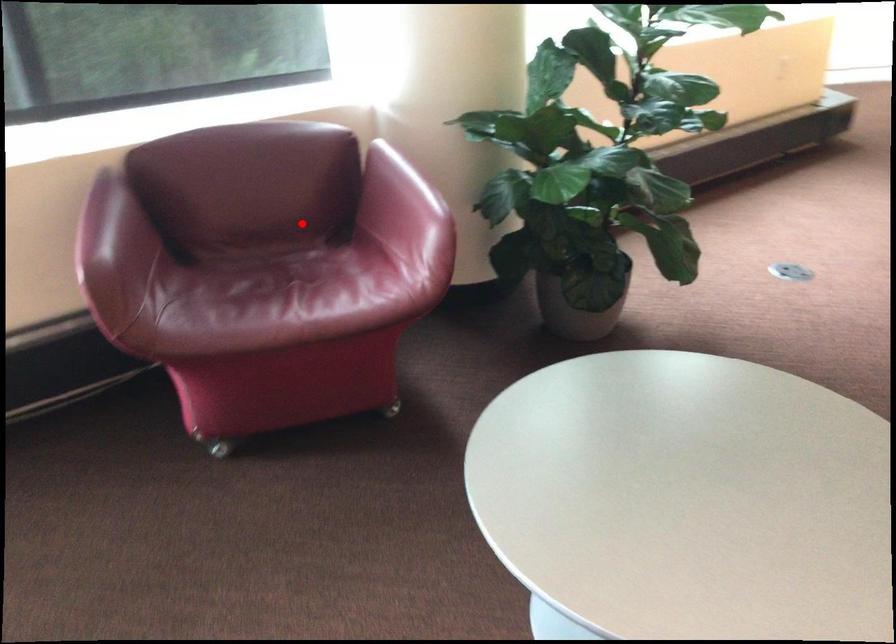
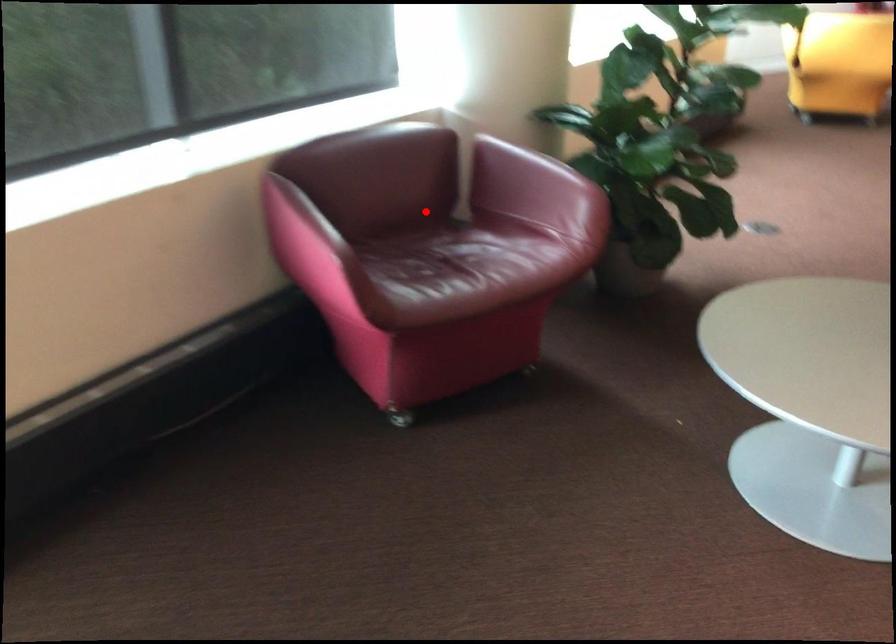
I am providing you with two images of the same scene from different viewpoints. A red point is marked on the first image and another point is marked on the second image. Is the red point in image1 aligned with the point shown in image2?

Yes